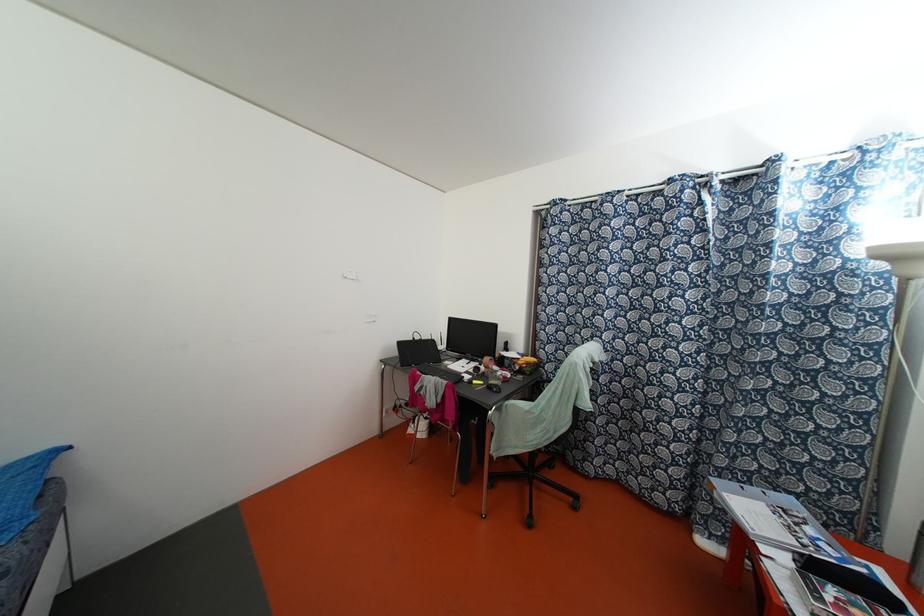
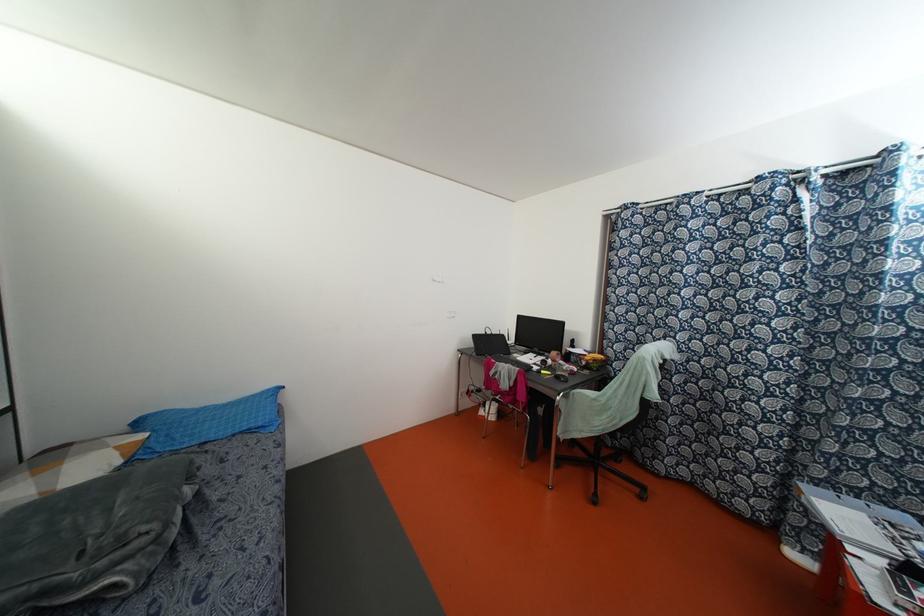
Locate, in the second image, the point that corresponds to [495,411] in the first image.

(564, 399)